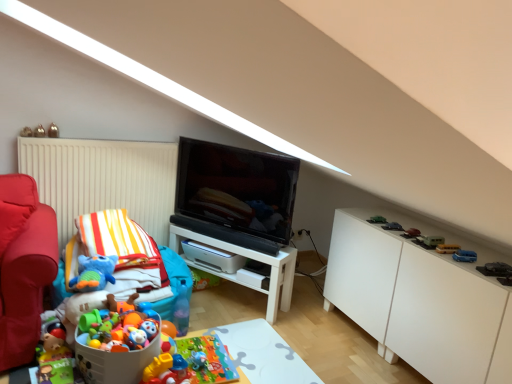
Question: Is matte black tv at center not close to white glossy cabinet at right?

Choices:
 (A) yes
 (B) no

Answer: (B)

Question: Considering the relative sizes of matte black tv at center and white glossy cabinet at right in the image provided, is matte black tv at center bigger than white glossy cabinet at right?

Choices:
 (A) yes
 (B) no

Answer: (B)

Question: From a real-world perspective, is matte black tv at center physically above white glossy cabinet at right?

Choices:
 (A) yes
 (B) no

Answer: (A)

Question: Does matte black tv at center appear on the right side of white glossy cabinet at right?

Choices:
 (A) yes
 (B) no

Answer: (B)

Question: From a real-world perspective, is matte black tv at center beneath white glossy cabinet at right?

Choices:
 (A) yes
 (B) no

Answer: (B)

Question: Considering the relative sizes of matte black tv at center and white glossy cabinet at right in the image provided, is matte black tv at center thinner than white glossy cabinet at right?

Choices:
 (A) yes
 (B) no

Answer: (A)

Question: Does green matte toy car at right, positioned as the 7th toy in right-to-left order, come in front of yellow matte school bus at right, the tenth toy when ordered from left to right?

Choices:
 (A) no
 (B) yes

Answer: (A)

Question: Can you confirm if green matte toy car at right, which is counted as the tenth toy, starting from the bottom, is wider than yellow matte school bus at right, the 7th toy viewed from the top?

Choices:
 (A) no
 (B) yes

Answer: (A)

Question: Is green matte toy car at right, placed as the sixth toy when sorted from left to right, completely or partially outside of yellow matte school bus at right, placed as the 6th toy when sorted from bottom to top?

Choices:
 (A) no
 (B) yes

Answer: (B)

Question: Is green matte toy car at right, placed as the sixth toy when sorted from left to right, taller than yellow matte school bus at right, the 7th toy viewed from the top?

Choices:
 (A) yes
 (B) no

Answer: (B)

Question: Is green matte toy car at right, placed as the sixth toy when sorted from left to right, further to camera compared to yellow matte school bus at right, the third toy viewed from the right?

Choices:
 (A) no
 (B) yes

Answer: (B)

Question: Considering the relative sizes of green matte toy car at right, positioned as the 7th toy in right-to-left order, and yellow matte school bus at right, the tenth toy when ordered from left to right, in the image provided, is green matte toy car at right, positioned as the 7th toy in right-to-left order, thinner than yellow matte school bus at right, the tenth toy when ordered from left to right,?

Choices:
 (A) yes
 (B) no

Answer: (A)

Question: Is metallic silver toy at upper left, placed as the second toy when sorted from left to right, oriented away from metallic gold toy at upper left, which is counted as the 1th toy, starting from the left?

Choices:
 (A) no
 (B) yes

Answer: (A)